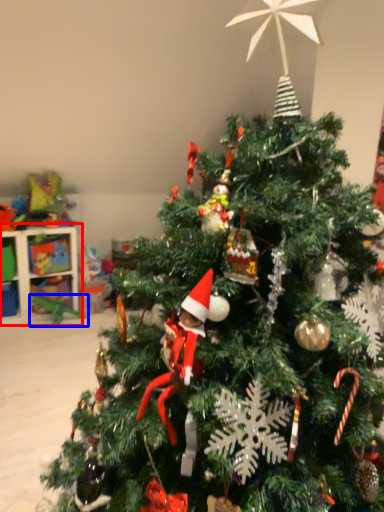
Question: Which point is closer to the camera, shelf (highlighted by a red box) or toy (highlighted by a blue box)?

Choices:
 (A) shelf
 (B) toy

Answer: (A)